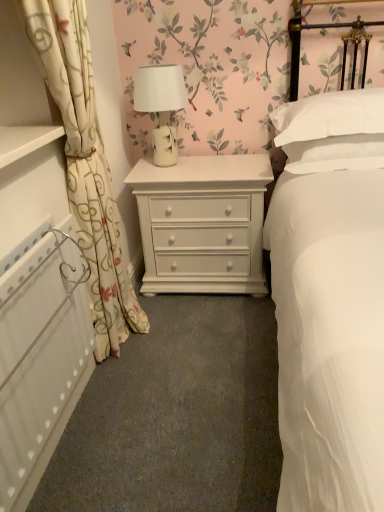
Locate an element on the screen. This screenshot has height=512, width=384. free space on the front side of white ceramic lamp at center is located at coordinates (180, 173).